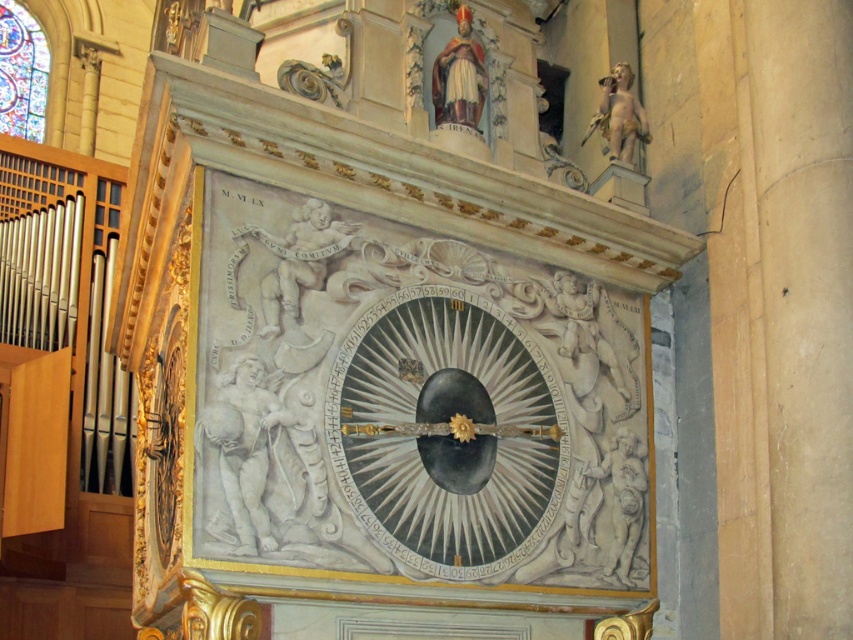
You are an art conservator assessing the architectural elements in the image. You need to determine which object is taller between the stained glass at upper left and the polychrome stone statue at upper center. Based on the scene, which one is taller?

The stained glass at upper left is much taller than the polychrome stone statue at upper center according to the description.

You are an interior designer planning to install a new lighting fixture in this space. The lighting fixture must be placed above the black polished wood clock at center without obstructing the white marble cherub at upper right. Given their sizes, is this placement feasible?

The black polished wood clock at center has a smaller size compared to the white marble cherub at upper right. Since the clock is smaller, placing a lighting fixture above it while avoiding obstruction of the larger cherub is feasible.